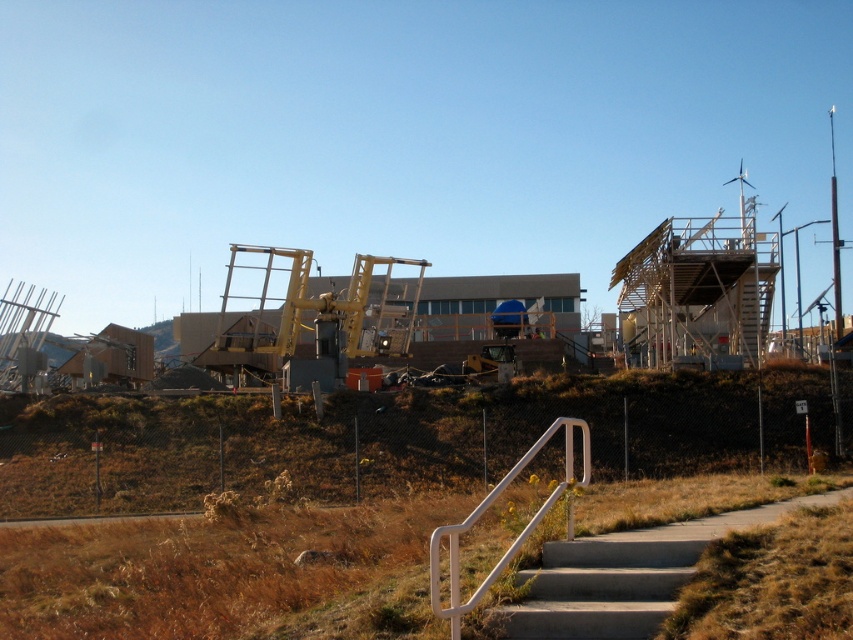
Is concrete/steps at lower right wider than white plastic handrail at lower center?

No, concrete/steps at lower right is not wider than white plastic handrail at lower center.

Between concrete/steps at lower right and white plastic handrail at lower center, which one has less height?

concrete/steps at lower right is shorter.

The image size is (853, 640). Identify the location of concrete/steps at lower right. (625, 576).

I want to click on concrete/steps at lower right, so click(x=625, y=576).